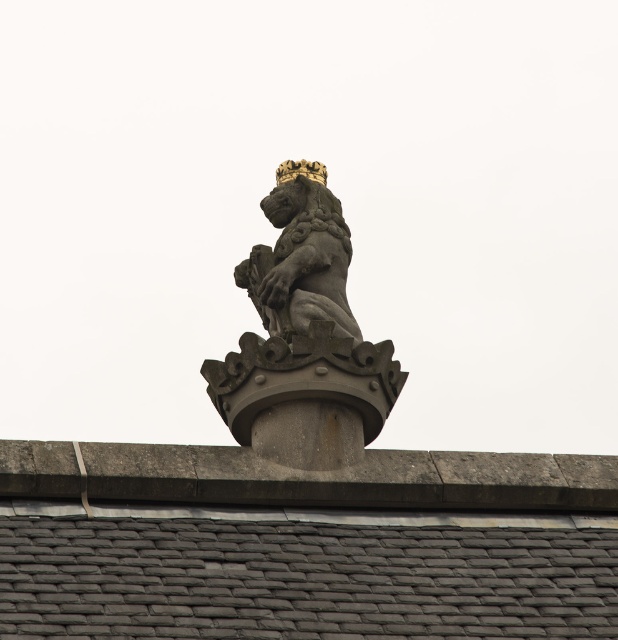
Question: Which of these objects is positioned closest to the polished stone lion at center?

Choices:
 (A) dark gray stone lion at center
 (B) gray slate roof at center

Answer: (A)

Question: Is dark gray stone lion at center to the left of polished stone lion at center from the viewer's perspective?

Choices:
 (A) no
 (B) yes

Answer: (B)

Question: Among these points, which one is farthest from the camera?

Choices:
 (A) (328, 365)
 (B) (290, 168)

Answer: (B)

Question: Can you confirm if gray slate roof at center is thinner than polished stone lion at center?

Choices:
 (A) yes
 (B) no

Answer: (B)

Question: Observing the image, what is the correct spatial positioning of gray slate roof at center in reference to dark gray stone lion at center?

Choices:
 (A) below
 (B) above

Answer: (A)

Question: Which object is positioned farthest from the polished stone lion at center?

Choices:
 (A) dark gray stone lion at center
 (B) gray slate roof at center

Answer: (B)